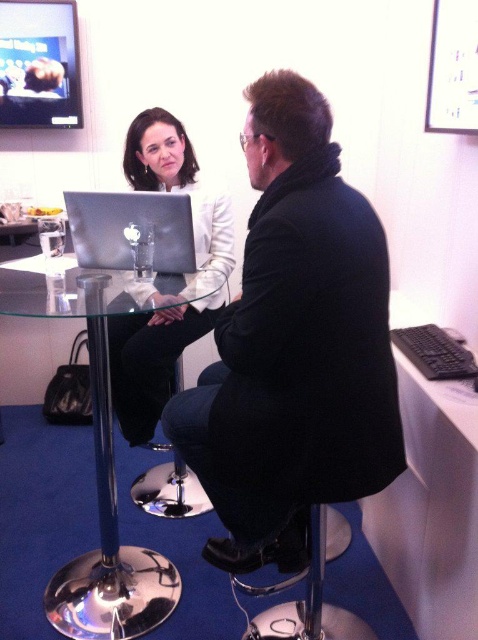
You are planning to place a large rectangular box on the transparent glass table at center. The box is the same size as the dark blue fabric bar stool at center. Will the box fit on the table?

The transparent glass table at center is bigger than the dark blue fabric bar stool at center. Since the box is the same size as the stool, it will fit on the table.

You are standing in the office scene described. There is a point at coordinates (152,284). What object is located at that point?

The white matte jacket at center is located at point (152,284).

You are standing at the entrance of the room and want to find the white matte jacket at center. According to the coordinates provided, where should you look relative to the computer monitor and keyboard?

The white matte jacket at center is located at point coordinates closer to the computer monitor and keyboard since its position is at point coordinates closer to them based on the given coordinates.